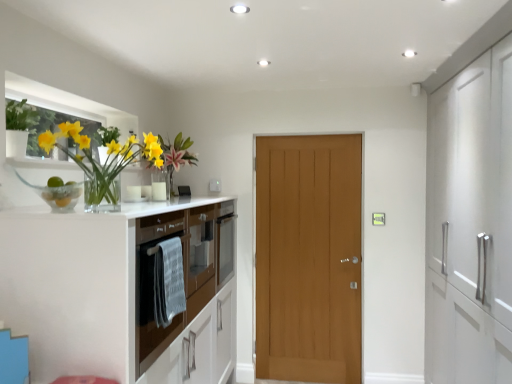
The width and height of the screenshot is (512, 384). What do you see at coordinates (308, 258) in the screenshot? I see `light brown wood door at center` at bounding box center [308, 258].

Locate an element on the screen. The height and width of the screenshot is (384, 512). light brown wood door at center is located at coordinates (308, 258).

Locate an element on the screen. This screenshot has height=384, width=512. translucent glass vase at left is located at coordinates (105, 159).

Considering the sizes of light brown wood door at center and green matte plant at upper left in the image, is light brown wood door at center wider or thinner than green matte plant at upper left?

Clearly, light brown wood door at center has less width compared to green matte plant at upper left.

I want to click on door below the green matte plant at upper left (from a real-world perspective), so click(x=308, y=258).

Considering the relative sizes of light brown wood door at center and green matte plant at upper left in the image provided, is light brown wood door at center bigger than green matte plant at upper left?

Yes, light brown wood door at center is bigger than green matte plant at upper left.

This screenshot has height=384, width=512. I want to click on floral arrangement lying in front of the light brown wood door at center, so click(x=105, y=159).

From the image's perspective, is translucent glass vase at left on top of light brown wood door at center?

Yes, from the image's perspective, translucent glass vase at left is on top of light brown wood door at center.

Considering the relative sizes of translucent glass vase at left and light brown wood door at center in the image provided, is translucent glass vase at left thinner than light brown wood door at center?

In fact, translucent glass vase at left might be wider than light brown wood door at center.

Would you say light brown wood door at center is inside or outside brown glossy oven at left?

The correct answer is: outside.

At what (x,y) coordinates should I click in order to perform the action: click on door behind the brown glossy oven at left. Please return your answer as a coordinate pair (x, y). The height and width of the screenshot is (384, 512). Looking at the image, I should click on (308, 258).

How far apart are light brown wood door at center and brown glossy oven at left?

light brown wood door at center is 4.00 feet away from brown glossy oven at left.

Which of these two, light brown wood door at center or brown glossy oven at left, stands taller?

light brown wood door at center.

Is brown glossy oven at left with light brown wood door at center?

brown glossy oven at left and light brown wood door at center are not in contact.

Would you say brown glossy oven at left is outside light brown wood door at center?

Yes.

In the image, is brown glossy oven at left positioned in front of or behind light brown wood door at center?

Visually, brown glossy oven at left is located in front of light brown wood door at center.

Measure the distance between brown glossy oven at left and light brown wood door at center.

The distance of brown glossy oven at left from light brown wood door at center is 4.00 feet.

Locate an element on the screen. The image size is (512, 384). door lying below the green matte plant at upper left (from the image's perspective) is located at coordinates (308, 258).

Does point (15, 124) appear closer or farther from the camera than point (296, 213)?

Point (15, 124) is closer to the camera than point (296, 213).

From the image's perspective, who appears lower, green matte plant at upper left or light brown wood door at center?

From the image's view, light brown wood door at center is below.

Looking at their sizes, would you say green matte plant at upper left is wider or thinner than light brown wood door at center?

Considering their sizes, green matte plant at upper left looks broader than light brown wood door at center.

In the image, is brown glossy oven at left positioned in front of or behind translucent glass vase at left?

Visually, brown glossy oven at left is located behind translucent glass vase at left.

Does brown glossy oven at left have a lesser width compared to translucent glass vase at left?

Incorrect, the width of brown glossy oven at left is not less than that of translucent glass vase at left.

Could you tell me if brown glossy oven at left is turned towards translucent glass vase at left?

No, brown glossy oven at left is not oriented towards translucent glass vase at left.

From a real-world perspective, is green matte plant at upper left located beneath translucent glass vase at left?

No.

Is green matte plant at upper left beside translucent glass vase at left?

No, green matte plant at upper left is not with translucent glass vase at left.

Locate an element on the screen. Image resolution: width=512 pixels, height=384 pixels. plant that is in front of the light brown wood door at center is located at coordinates (19, 126).

You are a GUI agent. You are given a task and a screenshot of the screen. Output one action in this format:
    pyautogui.click(x=<x>, y=<y>)
    Task: Click on the door that appears on the right of translucent glass vase at left
    The width and height of the screenshot is (512, 384).
    Given the screenshot: What is the action you would take?
    pyautogui.click(x=308, y=258)

Which object lies further to the anchor point translucent glass vase at left, light brown wood door at center or brown glossy oven at left?

light brown wood door at center.

Based on their spatial positions, is translucent glass vase at left or green matte plant at upper left closer to brown glossy oven at left?

translucent glass vase at left lies closer to brown glossy oven at left than the other object.

Considering their positions, is brown glossy oven at left positioned closer to translucent glass vase at left than green matte plant at upper left?

green matte plant at upper left is closer to translucent glass vase at left.

When comparing their distances from brown glossy oven at left, does green matte plant at upper left or light brown wood door at center seem further?

Among the two, light brown wood door at center is located further to brown glossy oven at left.

From the picture: Considering their positions, is green matte plant at upper left positioned closer to translucent glass vase at left than light brown wood door at center?

green matte plant at upper left is closer to translucent glass vase at left.

Which object lies further to the anchor point green matte plant at upper left, translucent glass vase at left or light brown wood door at center?

light brown wood door at center is further to green matte plant at upper left.

Based on the photo, looking at the image, which one is located further to translucent glass vase at left, brown glossy oven at left or light brown wood door at center?

light brown wood door at center is positioned further to the anchor translucent glass vase at left.

Estimate the real-world distances between objects in this image. Which object is closer to light brown wood door at center, green matte plant at upper left or brown glossy oven at left?

brown glossy oven at left is closer to light brown wood door at center.

Where is `plant between translucent glass vase at left and light brown wood door at center along the z-axis`? The image size is (512, 384). plant between translucent glass vase at left and light brown wood door at center along the z-axis is located at coordinates (19, 126).

In order to click on cabinetry positioned between translucent glass vase at left and light brown wood door at center from near to far in this screenshot , I will do `click(119, 291)`.

The width and height of the screenshot is (512, 384). I want to click on floral arrangement that lies between green matte plant at upper left and brown glossy oven at left from top to bottom, so click(x=105, y=159).

The image size is (512, 384). I want to click on plant located between brown glossy oven at left and light brown wood door at center in the depth direction, so click(19, 126).